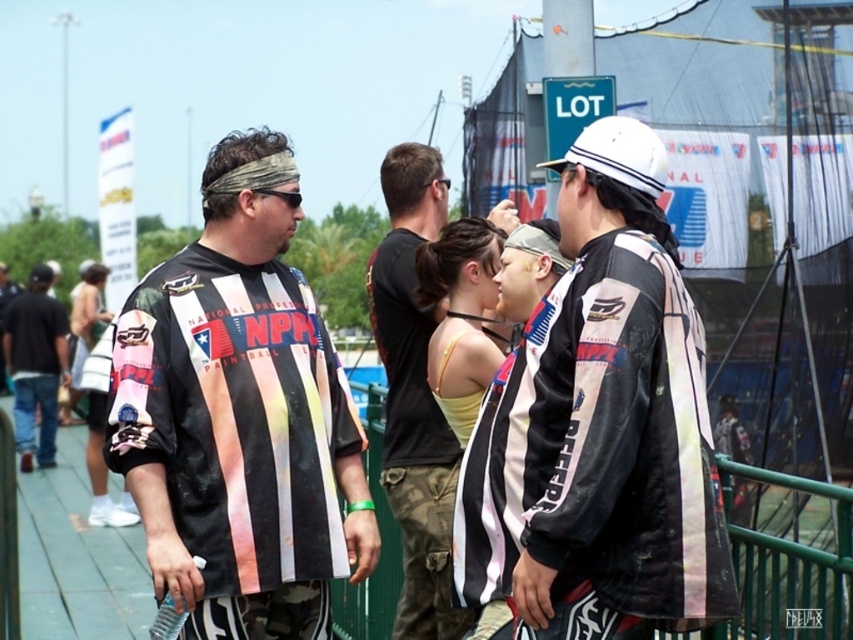
Question: Can you confirm if black cotton t-shirt at left is bigger than matte black tank top at center?

Choices:
 (A) yes
 (B) no

Answer: (B)

Question: Based on their relative distances, which object is farther from the matte black jacket at center?

Choices:
 (A) yellow fabric top at center
 (B) black leather jacket at center

Answer: (B)

Question: Does black leather jacket at center appear on the right side of printed jersey at center?

Choices:
 (A) no
 (B) yes

Answer: (B)

Question: Can you confirm if camouflage pants at center is positioned below yellow fabric top at center?

Choices:
 (A) yes
 (B) no

Answer: (A)

Question: Estimate the real-world distances between objects in this image. Which object is farther from the black leather jacket at center?

Choices:
 (A) black cotton t-shirt at left
 (B) camouflage pants at center
 (C) matte black tank top at center

Answer: (A)

Question: Which point appears closest to the camera in this image?

Choices:
 (A) (465, 288)
 (B) (393, 618)

Answer: (A)